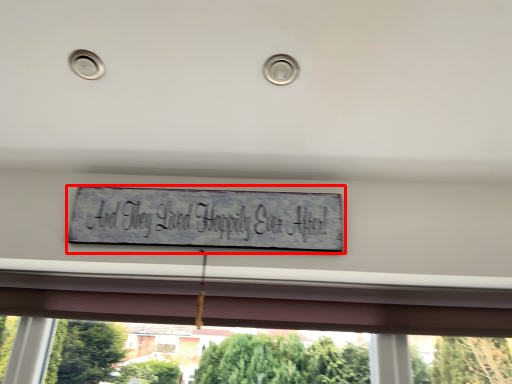
Question: Considering the relative positions of sign (annotated by the red box) and window in the image provided, where is sign (annotated by the red box) located with respect to the staircase?

Choices:
 (A) right
 (B) left

Answer: (B)